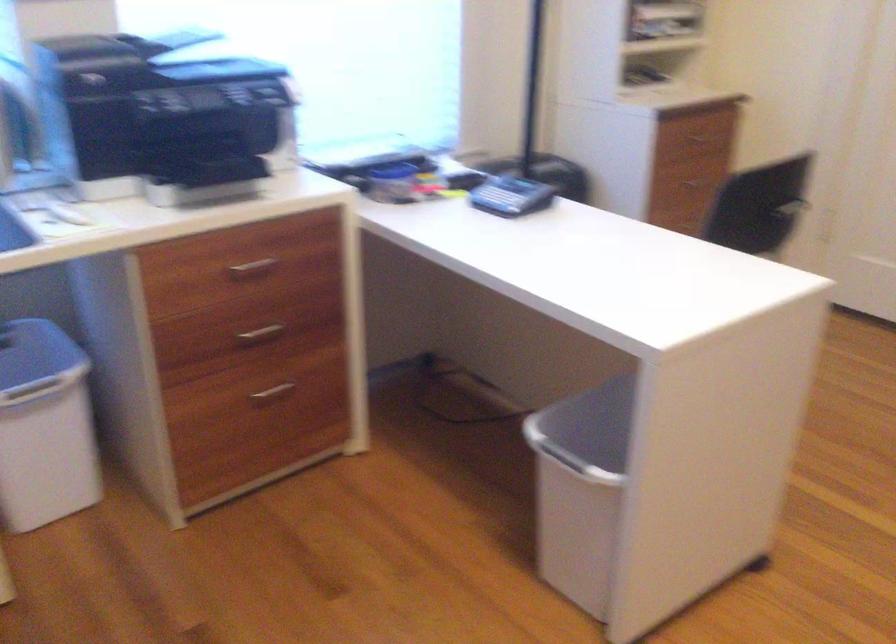
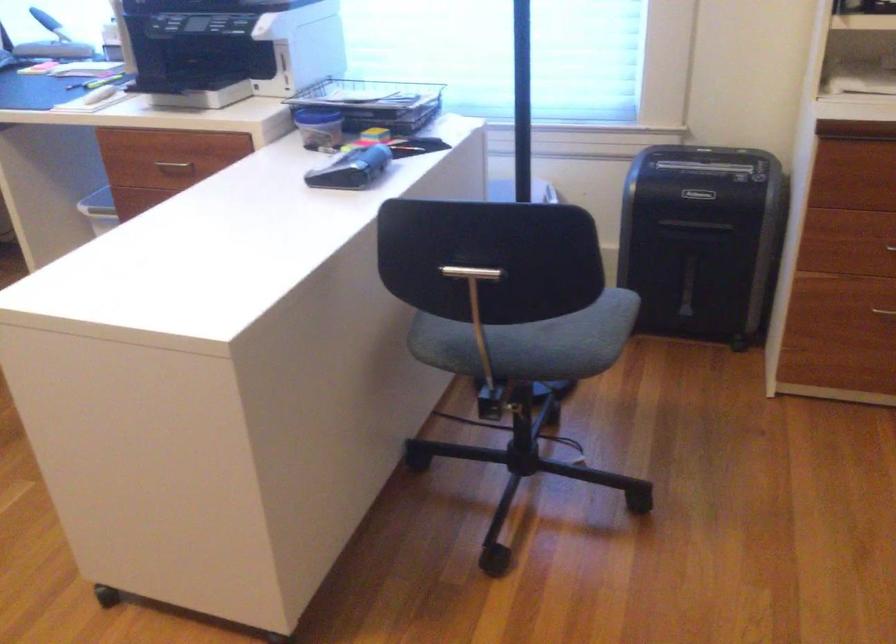
The point at (400, 158) is marked in the first image. Where is the corresponding point in the second image?

(374, 102)